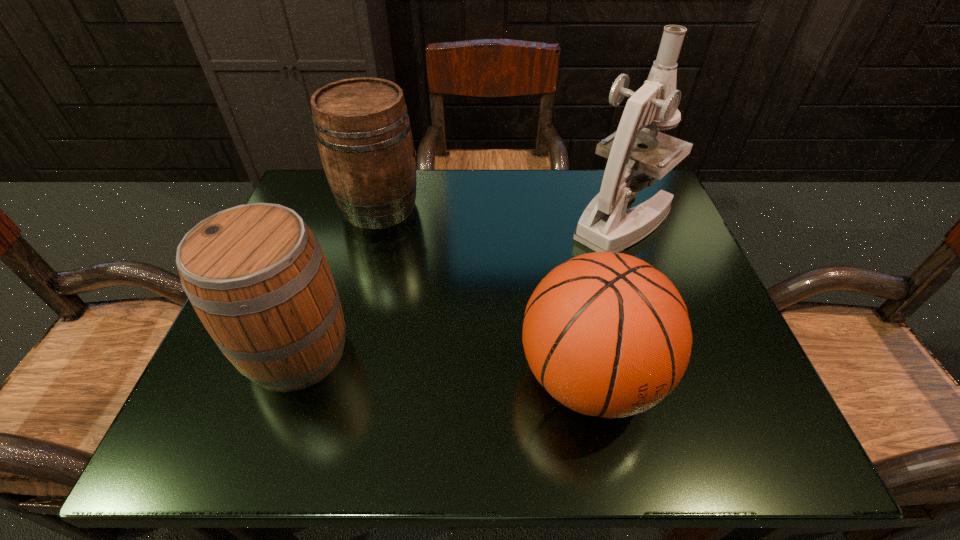
You are a GUI agent. You are given a task and a screenshot of the screen. Output one action in this format:
    pyautogui.click(x=<x>, y=<y>)
    Task: Click on the free space at the right edge of the desktop
    This screenshot has width=960, height=540.
    Given the screenshot: What is the action you would take?
    pyautogui.click(x=705, y=355)

At what (x,y) coordinates should I click in order to perform the action: click on vacant space at the far left corner of the desktop. Please return your answer as a coordinate pair (x, y). Image resolution: width=960 pixels, height=540 pixels. Looking at the image, I should click on (324, 187).

In the image, there is a desktop. At what (x,y) coordinates should I click in order to perform the action: click on free space at the near left corner. Please return your answer as a coordinate pair (x, y). Looking at the image, I should click on (292, 402).

In order to click on empty space that is in between the nearer cider and the microscope in this screenshot , I will do click(460, 286).

At what (x,y) coordinates should I click in order to perform the action: click on free space between the farther cider and the basketball. Please return your answer as a coordinate pair (x, y). Image resolution: width=960 pixels, height=540 pixels. Looking at the image, I should click on (484, 292).

This screenshot has height=540, width=960. I want to click on vacant area between the farther cider and the basketball, so coord(484,292).

The width and height of the screenshot is (960, 540). What are the coordinates of `free spot between the nearer cider and the farther cider` in the screenshot? It's located at (339, 279).

The width and height of the screenshot is (960, 540). Find the location of `vacant area between the farther cider and the nearer cider`. vacant area between the farther cider and the nearer cider is located at coordinates pyautogui.click(x=339, y=279).

The width and height of the screenshot is (960, 540). I want to click on vacant point located between the basketball and the farther cider, so click(484, 292).

Find the location of `empty location between the farther cider and the basketball`. empty location between the farther cider and the basketball is located at coordinates (484, 292).